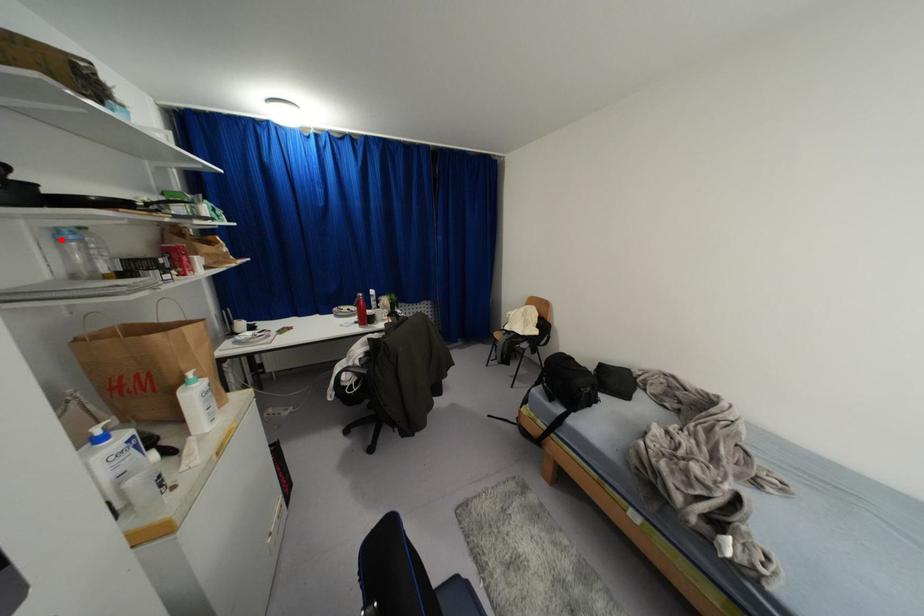
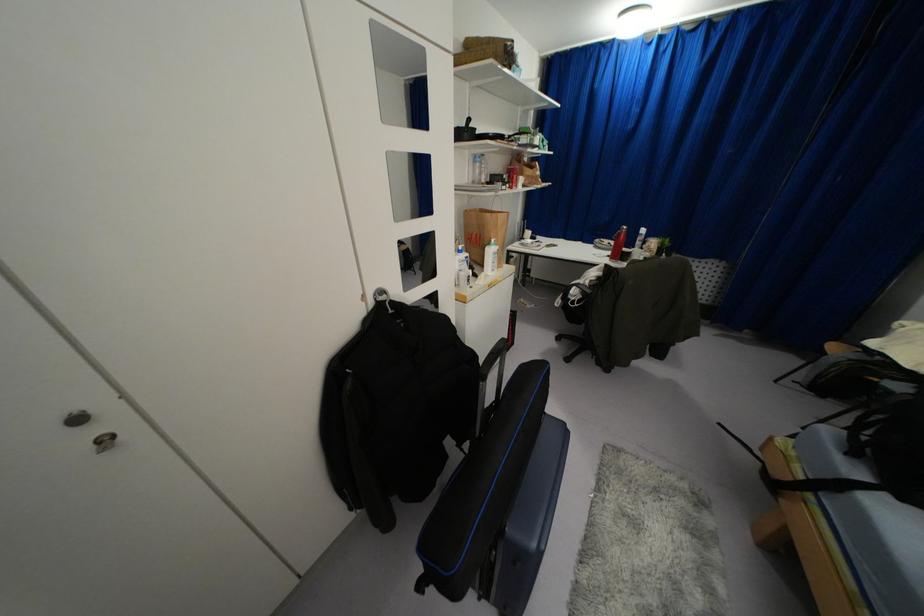
Question: I am providing you with two images of the same scene from different viewpoints. A red point is shown in image1. For the corresponding object point in image2, is it positioned nearer or farther from the camera?

Choices:
 (A) Nearer
 (B) Farther

Answer: (A)